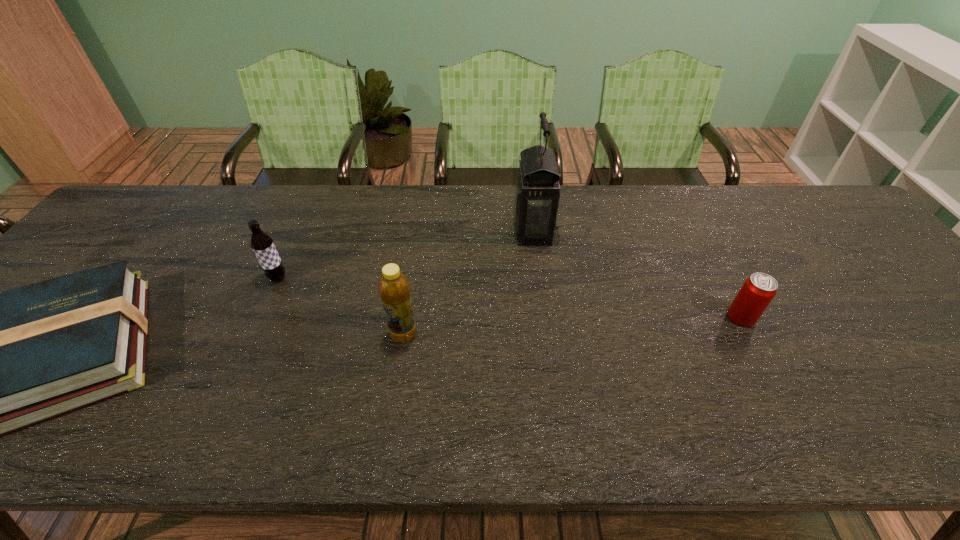
The height and width of the screenshot is (540, 960). Find the location of `free space located 0.200m on the left of the third object from left to right`. free space located 0.200m on the left of the third object from left to right is located at coordinates (303, 334).

You are a GUI agent. You are given a task and a screenshot of the screen. Output one action in this format:
    pyautogui.click(x=<x>, y=<y>)
    Task: Click on the vacant space situated on the right of the third tallest object
    
    Given the screenshot: What is the action you would take?
    pyautogui.click(x=333, y=278)

Locate an element on the screen. The width and height of the screenshot is (960, 540). free region located 0.180m on the back of the rightmost object is located at coordinates (709, 256).

The image size is (960, 540). In order to click on object located at the far edge in this screenshot , I will do `click(537, 191)`.

In the image, there is a desktop. Where is `blank space at the far edge`? blank space at the far edge is located at coordinates (222, 226).

You are a GUI agent. You are given a task and a screenshot of the screen. Output one action in this format:
    pyautogui.click(x=<x>, y=<y>)
    Task: Click on the vacant point at the near edge
    The height and width of the screenshot is (540, 960).
    Given the screenshot: What is the action you would take?
    pyautogui.click(x=321, y=410)

Locate an element on the screen. Image resolution: width=960 pixels, height=540 pixels. vacant region at the far left corner of the desktop is located at coordinates (136, 224).

Where is `free spot between the bottle and the can`? free spot between the bottle and the can is located at coordinates (572, 326).

Where is `empty space between the fourth object from left to right and the rightmost object`? empty space between the fourth object from left to right and the rightmost object is located at coordinates (637, 274).

Identify the location of free space between the rightmost object and the farthest object. (637, 274).